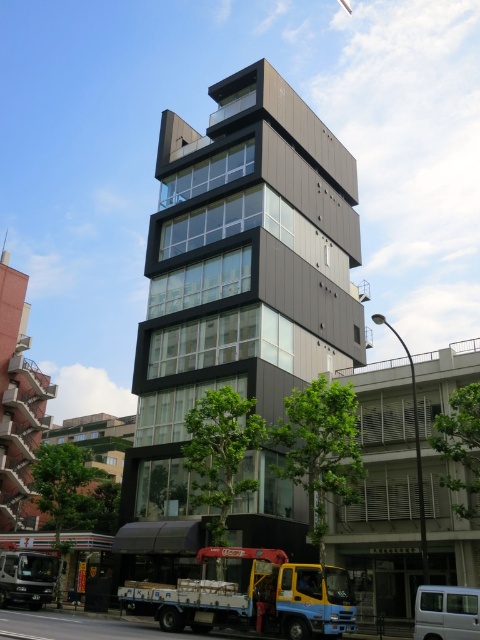
Question: Among these objects, which one is farthest from the camera?

Choices:
 (A) yellow metallic truck at lower left
 (B) yellow metallic truck at lower center

Answer: (A)

Question: Can you confirm if yellow metallic truck at lower center is positioned above yellow metallic truck at lower left?

Choices:
 (A) yes
 (B) no

Answer: (A)

Question: Among these points, which one is nearest to the camera?

Choices:
 (A) (290, 596)
 (B) (57, 564)

Answer: (A)

Question: From the image, what is the correct spatial relationship of yellow metallic truck at lower center in relation to yellow metallic truck at lower left?

Choices:
 (A) below
 (B) above

Answer: (B)

Question: Which point is closer to the camera?

Choices:
 (A) (13, 600)
 (B) (259, 589)

Answer: (B)

Question: Is yellow metallic truck at lower center bigger than yellow metallic truck at lower left?

Choices:
 (A) no
 (B) yes

Answer: (B)